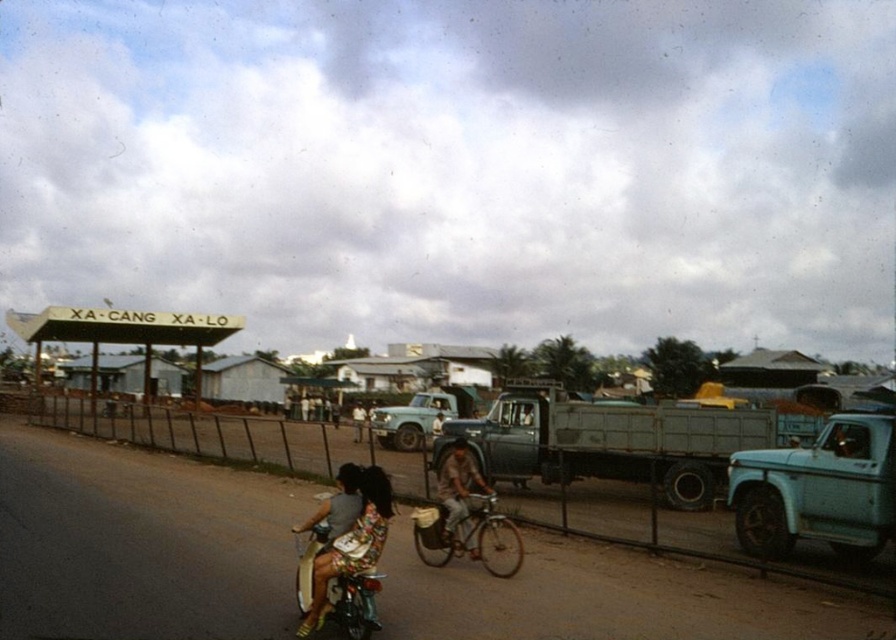
You are a delivery person who needs to place a package on the brown dirt track at center. The package is 10 cm tall. Will the metallic silver bicycle at center block the package from being seen by someone standing at the road level?

The brown dirt track at center has a lesser height compared to metallic silver bicycle at center. Since the package is 10 cm tall, the metallic silver bicycle at center may block the view depending on the distance, but based on height alone, the bicycle is taller so it could obscure the package if placed directly behind it.

You are a delivery driver who needs to park your light blue metallic truck at center near the light brown wooden bicycle at center. Given the space available, can you safely park your truck without blocking the bicycle?

The light blue metallic truck at center is larger in size than the light brown wooden bicycle at center. Since the truck is bigger, it might require more space to park. However, the exact dimensions of the area aren not provided, so it depends on whether there is enough space available to accommodate the truck without obstructing the bicycle.